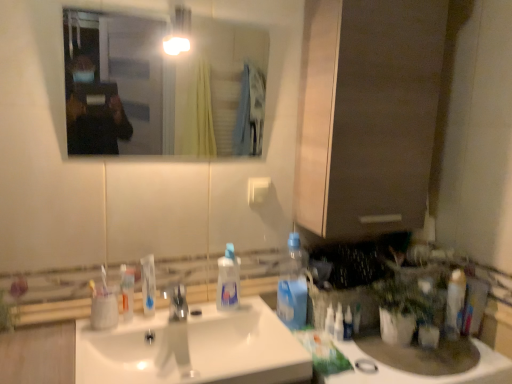
Question: From the image's perspective, is matte brown cabinet at center below white glossy toothpaste tube at right, which ranks as the 2th toiletry in left-to-right order?

Choices:
 (A) no
 (B) yes

Answer: (A)

Question: Considering the relative sizes of matte brown cabinet at center and white glossy toothpaste tube at right, which ranks as the 2th toiletry in left-to-right order, in the image provided, is matte brown cabinet at center shorter than white glossy toothpaste tube at right, which ranks as the 2th toiletry in left-to-right order,?

Choices:
 (A) yes
 (B) no

Answer: (B)

Question: Is matte brown cabinet at center oriented towards white glossy toothpaste tube at right, which ranks as the 2th toiletry in left-to-right order?

Choices:
 (A) yes
 (B) no

Answer: (B)

Question: Does matte brown cabinet at center have a lesser width compared to white glossy toothpaste tube at right, placed as the first toiletry when sorted from right to left?

Choices:
 (A) no
 (B) yes

Answer: (A)

Question: Is matte brown cabinet at center taller than white glossy toothpaste tube at right, placed as the first toiletry when sorted from right to left?

Choices:
 (A) yes
 (B) no

Answer: (A)

Question: Is white glossy toothpaste at center taller or shorter than matte brown cabinet at center?

Choices:
 (A) tall
 (B) short

Answer: (B)

Question: Considering the positions of white glossy toothpaste at center and matte brown cabinet at center in the image, is white glossy toothpaste at center wider or thinner than matte brown cabinet at center?

Choices:
 (A) thin
 (B) wide

Answer: (A)

Question: Is white glossy toothpaste at center bigger or smaller than matte brown cabinet at center?

Choices:
 (A) small
 (B) big

Answer: (A)

Question: Is white glossy toothpaste at center in front of or behind matte brown cabinet at center in the image?

Choices:
 (A) behind
 (B) front

Answer: (A)

Question: In the image, is white plastic toothbrush at left, the 2th toothbrush when ordered from left to right, positioned in front of or behind white plastic toothpaste tube at lower right, which appears as the second toiletry when viewed from the right?

Choices:
 (A) front
 (B) behind

Answer: (A)

Question: Based on their positions, is white plastic toothbrush at left, the 2th toothbrush when ordered from left to right, located to the left or right of white plastic toothpaste tube at lower right, which appears as the second toiletry when viewed from the right?

Choices:
 (A) left
 (B) right

Answer: (A)

Question: From the image's perspective, is white plastic toothbrush at left, the 1th toothbrush viewed from the right, positioned above or below white plastic toothpaste tube at lower right, which appears as the first toiletry when viewed from the left?

Choices:
 (A) above
 (B) below

Answer: (A)

Question: Considering the positions of point (101, 266) and point (343, 326), is point (101, 266) closer or farther from the camera than point (343, 326)?

Choices:
 (A) farther
 (B) closer

Answer: (B)

Question: Looking at the image, does polished chrome faucet at center seem bigger or smaller compared to clear glass mirror at upper center?

Choices:
 (A) small
 (B) big

Answer: (A)

Question: From a real-world perspective, is polished chrome faucet at center above or below clear glass mirror at upper center?

Choices:
 (A) above
 (B) below

Answer: (B)